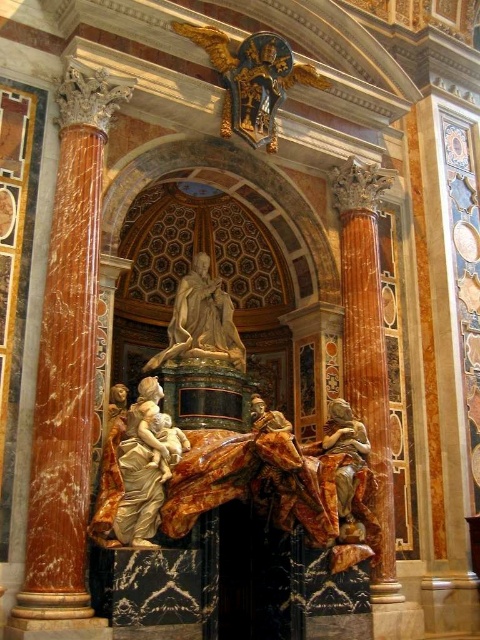
Does marble column at left have a lesser height compared to golden marble statue at lower left?

In fact, marble column at left may be taller than golden marble statue at lower left.

Between marble column at left and golden marble statue at lower left, which one has less height?

With less height is golden marble statue at lower left.

Is point (55, 497) positioned in front of point (101, 504)?

Yes, point (55, 497) is in front of point (101, 504).

Locate an element on the screen. marble column at left is located at coordinates (67, 372).

From the picture: Is the position of marble column at left more distant than that of golden polished statue at center?

That is False.

Can you confirm if marble column at left is smaller than golden polished statue at center?

No.

The image size is (480, 640). What do you see at coordinates (67, 372) in the screenshot?
I see `marble column at left` at bounding box center [67, 372].

Find the location of a particular element. The width and height of the screenshot is (480, 640). marble column at left is located at coordinates (67, 372).

Between polished marble statue at center and golden polished statue at center, which one appears on the right side from the viewer's perspective?

golden polished statue at center is more to the right.

What do you see at coordinates (201, 321) in the screenshot?
I see `polished marble statue at center` at bounding box center [201, 321].

The height and width of the screenshot is (640, 480). Describe the element at coordinates (201, 321) in the screenshot. I see `polished marble statue at center` at that location.

Locate an element on the screen. The width and height of the screenshot is (480, 640). polished marble statue at center is located at coordinates (201, 321).